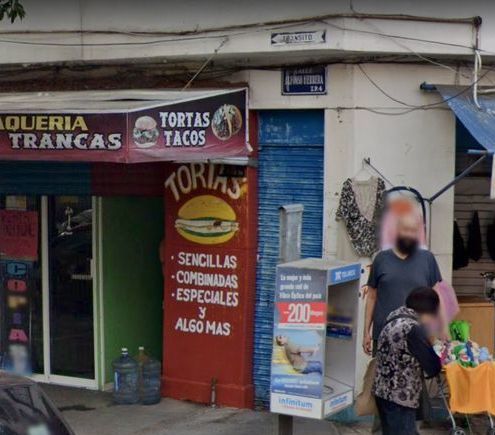
This screenshot has height=435, width=495. Find the location of `hanger`. hanger is located at coordinates (361, 165).